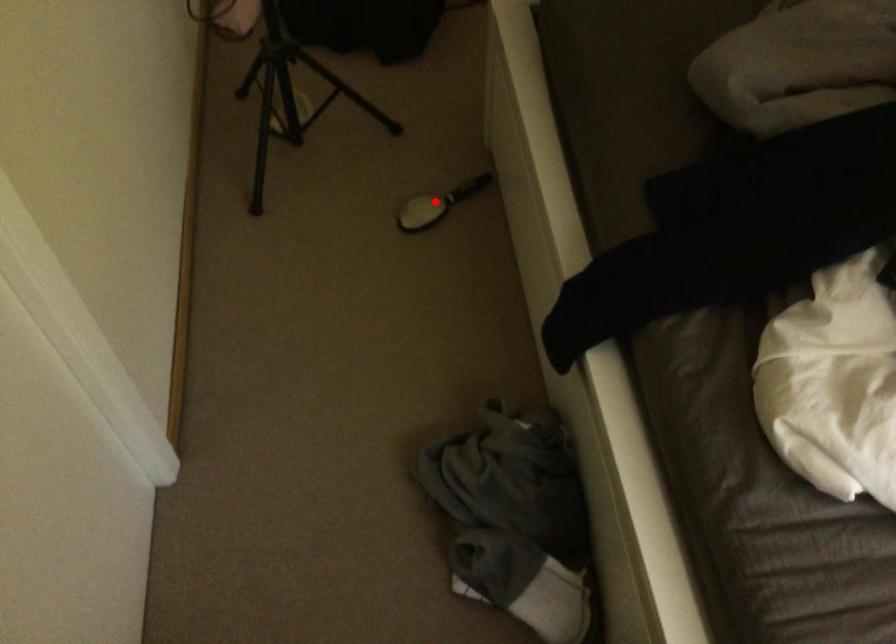
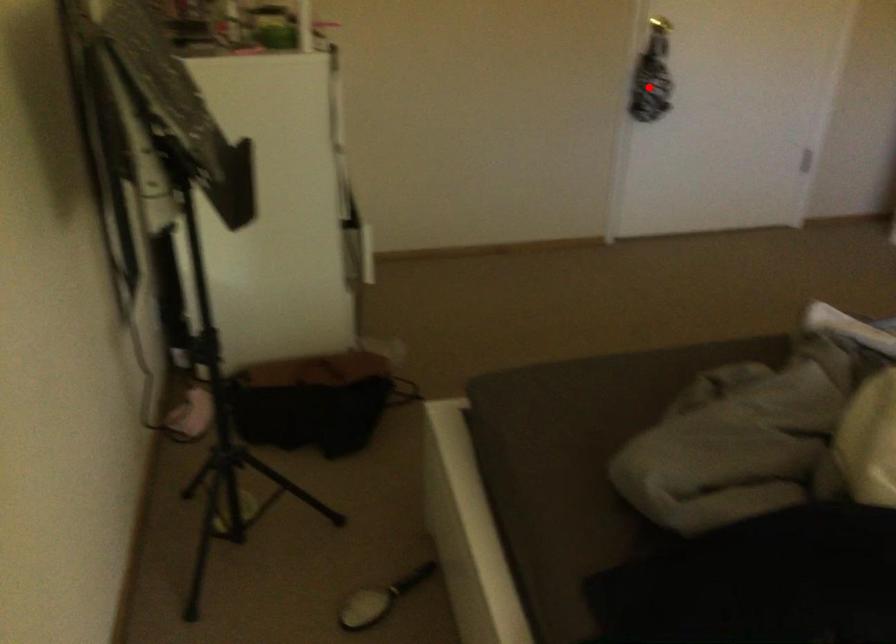
I am providing you with two images of the same scene from different viewpoints. A red point is marked on the first image and another point is marked on the second image. Do the highlighted points in image1 and image2 indicate the same real-world spot?

No